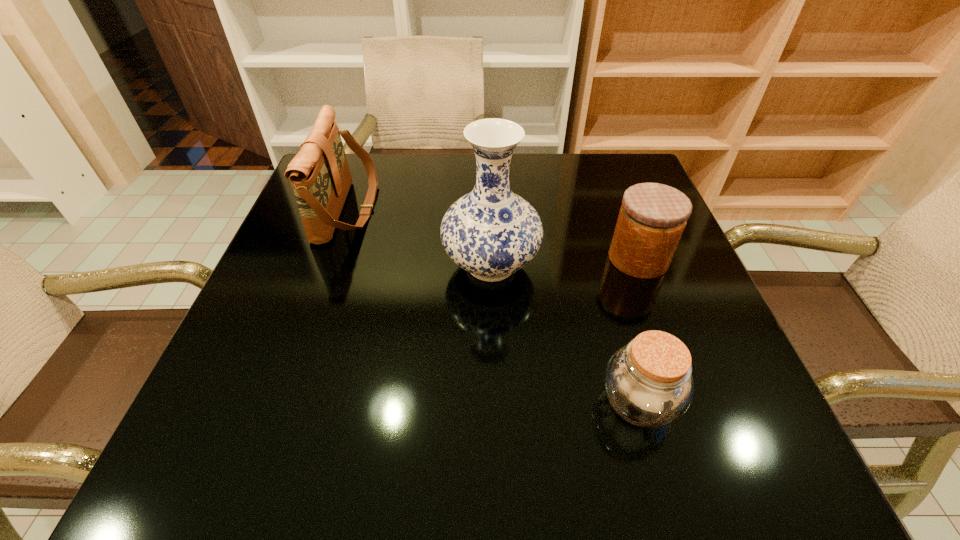
Where is `the second object from left to right`? the second object from left to right is located at coordinates (491, 232).

Locate an element on the screen. the tallest object is located at coordinates (491, 232).

You are a GUI agent. You are given a task and a screenshot of the screen. Output one action in this format:
    pyautogui.click(x=<x>, y=<y>)
    Task: Click on the shoulder bag
    This screenshot has height=540, width=960.
    Given the screenshot: What is the action you would take?
    pyautogui.click(x=319, y=174)

At what (x,y) coordinates should I click in order to perform the action: click on the leftmost object. Please return your answer as a coordinate pair (x, y). The width and height of the screenshot is (960, 540). Looking at the image, I should click on (319, 174).

Locate an element on the screen. This screenshot has width=960, height=540. the farther jar is located at coordinates (652, 218).

I want to click on the nearer jar, so click(x=648, y=382).

Where is `free space located 0.240m on the front of the tallest object`? The image size is (960, 540). free space located 0.240m on the front of the tallest object is located at coordinates (494, 416).

Locate an element on the screen. free space located 0.160m on the front-facing side of the shoulder bag is located at coordinates (441, 209).

Where is `vacant space located 0.170m on the back of the farther jar`? The image size is (960, 540). vacant space located 0.170m on the back of the farther jar is located at coordinates [x=614, y=195].

Find the location of a particular element. This screenshot has height=540, width=960. free space located 0.280m on the back of the nearer jar is located at coordinates (597, 257).